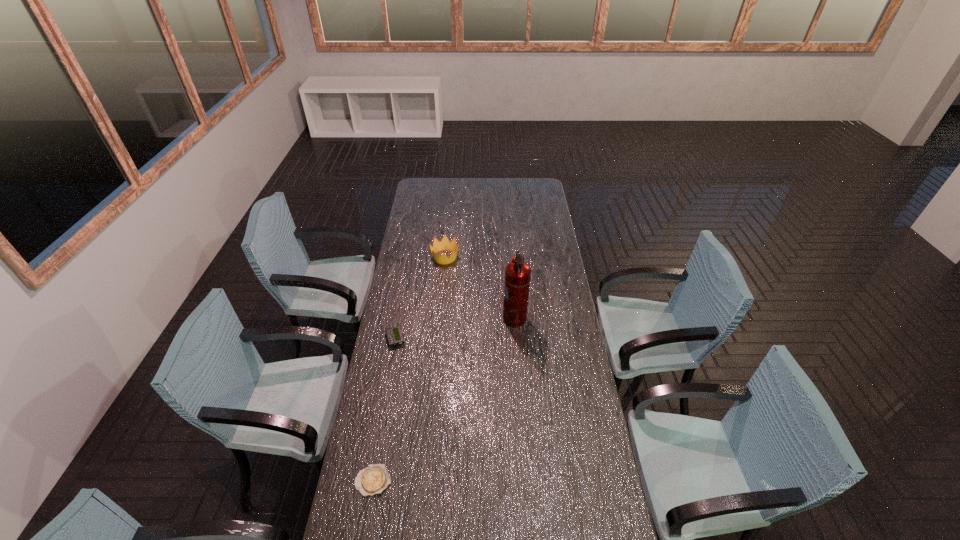
The width and height of the screenshot is (960, 540). In order to click on the rightmost object in this screenshot , I will do `click(517, 277)`.

Locate an element on the screen. This screenshot has width=960, height=540. the tallest object is located at coordinates (517, 277).

Where is `the second object from right to left`? The height and width of the screenshot is (540, 960). the second object from right to left is located at coordinates (438, 246).

At what (x,y) coordinates should I click in order to perform the action: click on the farthest object. Please return your answer as a coordinate pair (x, y). Looking at the image, I should click on (438, 246).

Where is `the second shortest object`? This screenshot has height=540, width=960. the second shortest object is located at coordinates (394, 335).

This screenshot has width=960, height=540. I want to click on the nearest object, so click(372, 480).

You are a GUI agent. You are given a task and a screenshot of the screen. Output one action in this format:
    pyautogui.click(x=<x>, y=<y>)
    Task: Click on the shortest object
    This screenshot has height=540, width=960.
    Given the screenshot: What is the action you would take?
    pyautogui.click(x=372, y=480)

Identify the location of vacant area situated 0.170m on the nozzle side of the fire extinguisher. (466, 319).

Locate an element on the screen. This screenshot has height=540, width=960. vacant region located 0.370m on the nozzle side of the fire extinguisher is located at coordinates tap(421, 319).

I want to click on free space located on the nozzle side of the fire extinguisher, so click(x=485, y=319).